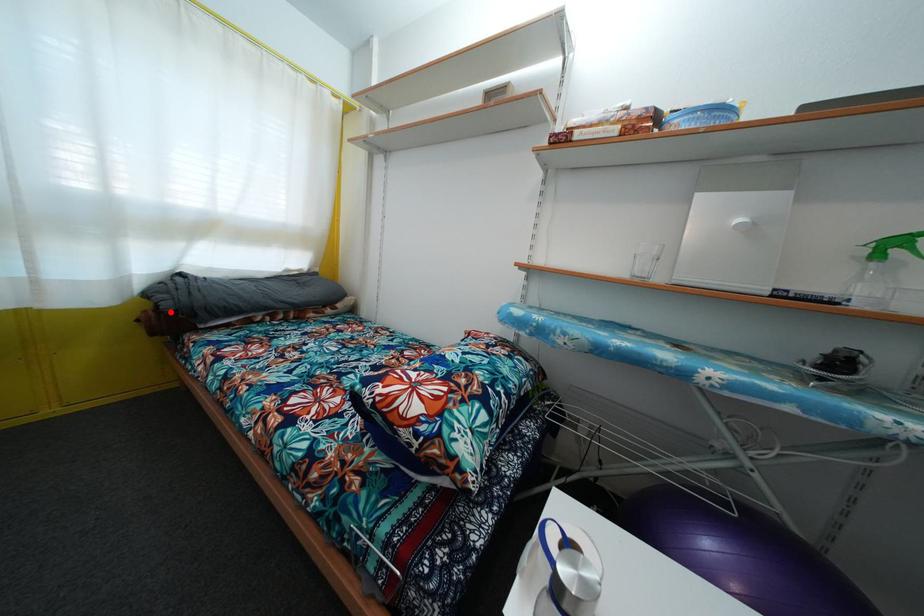
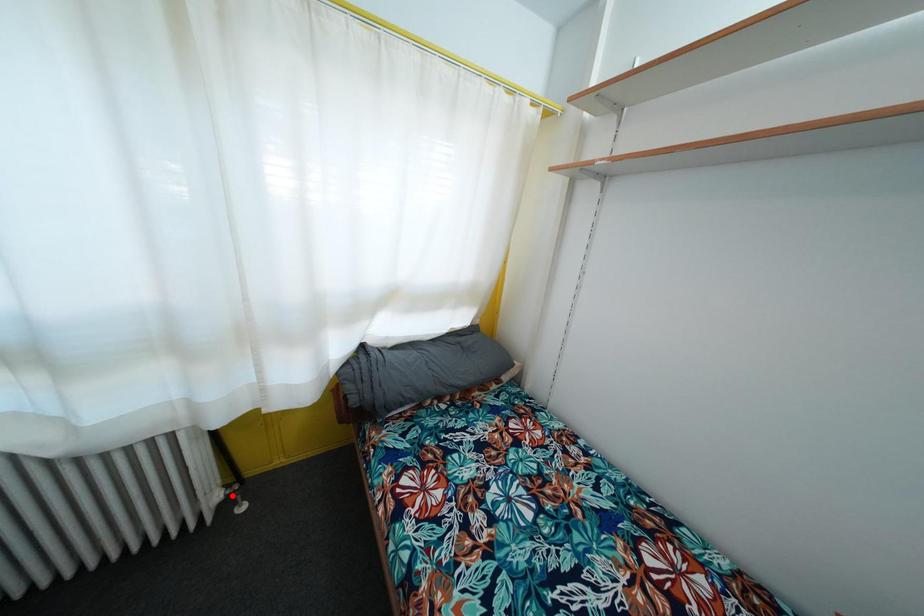
I am providing you with two images of the same scene from different viewpoints. A red point is marked on the first image and another point is marked on the second image. Does the point marked in image1 correspond to the same location as the one in image2?

No